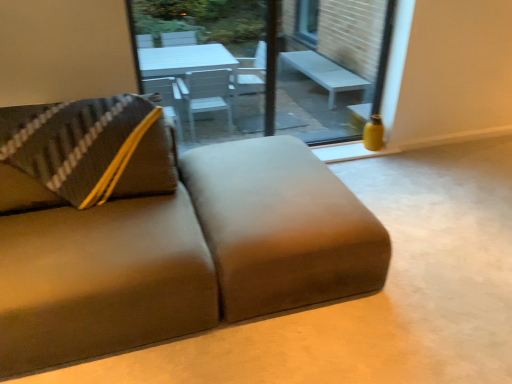
Where is `free spot above suede-like beige footrest at lower center (from a real-world perspective)`? free spot above suede-like beige footrest at lower center (from a real-world perspective) is located at coordinates (261, 168).